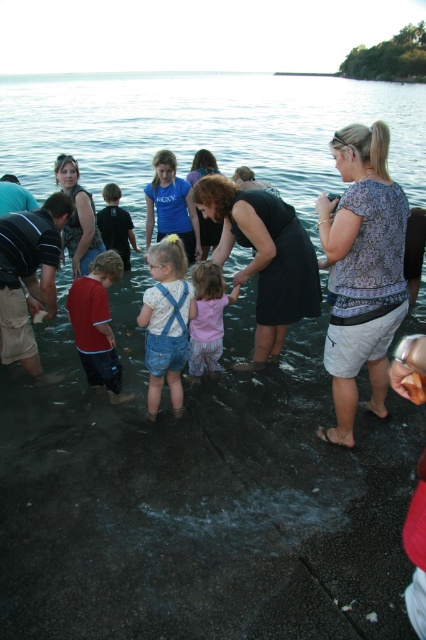
Is denim overalls at center wider than matte black dress at center?

No.

Which is above, denim overalls at center or matte black dress at center?

matte black dress at center

The image size is (426, 640). What are the coordinates of `denim overalls at center` in the screenshot? It's located at (166, 317).

Can you confirm if printed cotton blouse at center is shorter than red cotton shirt at center?

In fact, printed cotton blouse at center may be taller than red cotton shirt at center.

In the scene shown: Does printed cotton blouse at center have a greater width compared to red cotton shirt at center?

Yes, printed cotton blouse at center is wider than red cotton shirt at center.

Is point (356, 188) positioned after point (98, 253)?

That is False.

Identify the location of printed cotton blouse at center. (362, 269).

Which of these two, denim overalls at center or pink cotton shirt at center, stands taller?

denim overalls at center is taller.

Is point (175, 337) positioned before point (221, 339)?

Yes, point (175, 337) is in front of point (221, 339).

This screenshot has width=426, height=640. Find the location of `denim overalls at center`. denim overalls at center is located at coordinates (166, 317).